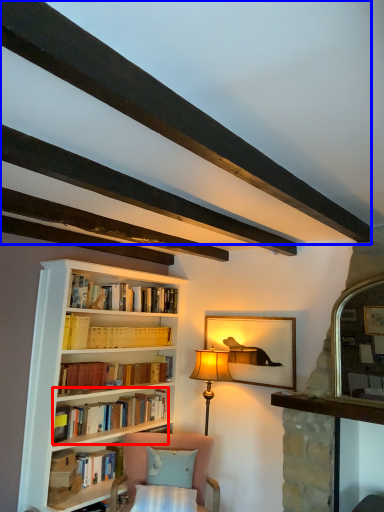
Question: Which point is further to the camera, book (highlighted by a red box) or plank (highlighted by a blue box)?

Choices:
 (A) book
 (B) plank

Answer: (A)